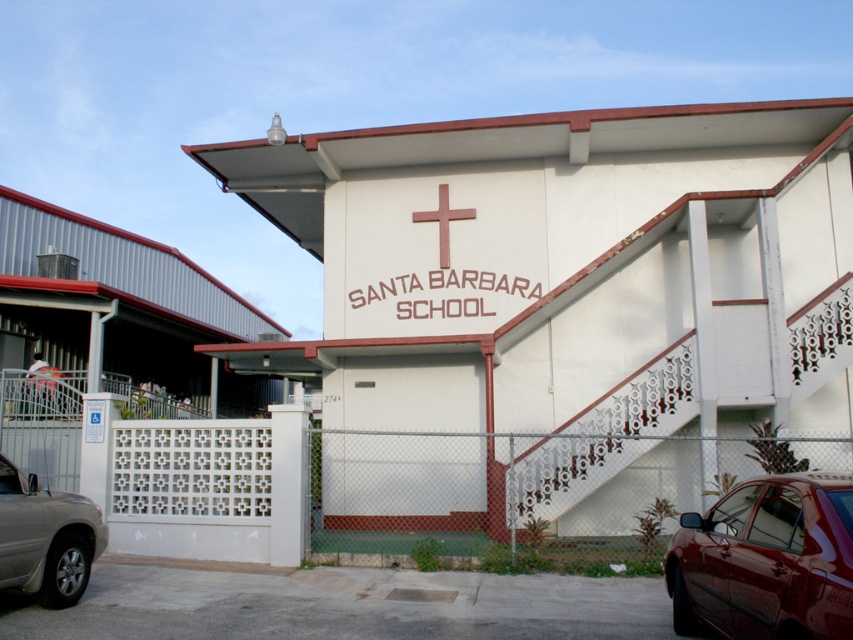
Question: Can you confirm if shiny dark red sedan at lower right is positioned to the right of silver metallic suv at lower left?

Choices:
 (A) yes
 (B) no

Answer: (A)

Question: Does white matte building at center have a lesser width compared to silver metallic suv at lower left?

Choices:
 (A) no
 (B) yes

Answer: (A)

Question: Which object appears closest to the camera in this image?

Choices:
 (A) white lattice fence at center
 (B) pink wooden cross at center
 (C) silver metallic suv at lower left

Answer: (C)

Question: Is white lattice fence at center closer to camera compared to silver metallic suv at lower left?

Choices:
 (A) yes
 (B) no

Answer: (B)

Question: Which object is farther from the camera taking this photo?

Choices:
 (A) silver metallic suv at lower left
 (B) shiny dark red sedan at lower right
 (C) white matte building at center

Answer: (C)

Question: Which object is the closest to the silver metallic suv at lower left?

Choices:
 (A) shiny dark red sedan at lower right
 (B) white matte building at center

Answer: (A)